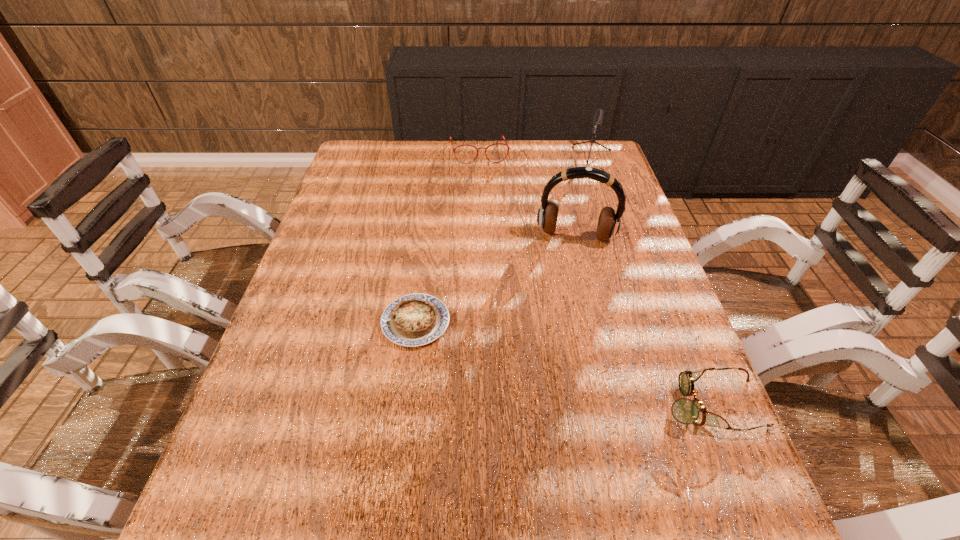
Locate an element on the screen. The width and height of the screenshot is (960, 540). the shortest object is located at coordinates (412, 320).

Locate an element on the screen. This screenshot has width=960, height=540. the second nearest object is located at coordinates (412, 320).

Where is `the nearest object`? the nearest object is located at coordinates (685, 411).

Identify the location of the right spectacles. The height and width of the screenshot is (540, 960). (685, 411).

At what (x,y) coordinates should I click in order to perform the action: click on headset. Please return your answer as a coordinate pair (x, y). This screenshot has height=540, width=960. Looking at the image, I should click on (609, 222).

Locate an element on the screen. the third farthest object is located at coordinates (609, 222).

Where is `microphone`? This screenshot has width=960, height=540. microphone is located at coordinates pos(596,121).

Find the location of a particular element. the taller spectacles is located at coordinates (506, 144).

Locate an element on the screen. The width and height of the screenshot is (960, 540). the left spectacles is located at coordinates (506, 144).

Where is `free spot located 0.230m on the right of the second nearest object`? This screenshot has width=960, height=540. free spot located 0.230m on the right of the second nearest object is located at coordinates (x=552, y=322).